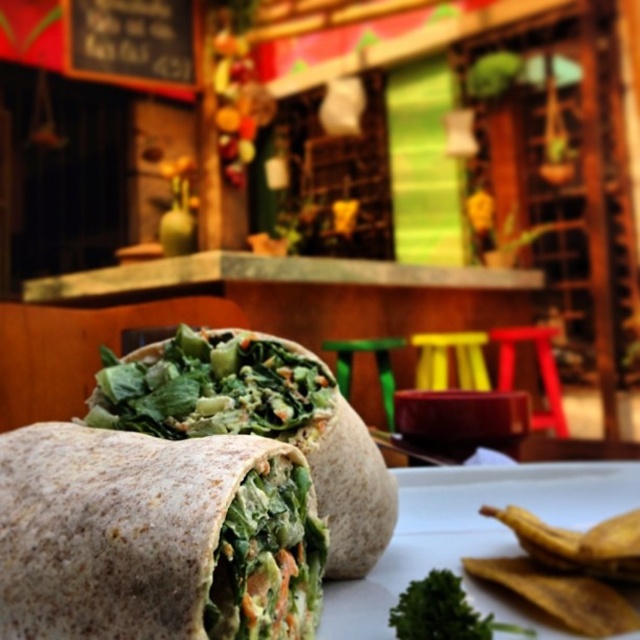
Can you confirm if whole wheat wrap at center is thinner than green leafy burrito at center?

Indeed, whole wheat wrap at center has a lesser width compared to green leafy burrito at center.

Is whole wheat wrap at center smaller than green leafy burrito at center?

Indeed, whole wheat wrap at center has a smaller size compared to green leafy burrito at center.

The width and height of the screenshot is (640, 640). In order to click on whole wheat wrap at center in this screenshot , I will do `click(156, 536)`.

The image size is (640, 640). Identify the location of whole wheat wrap at center. (156, 536).